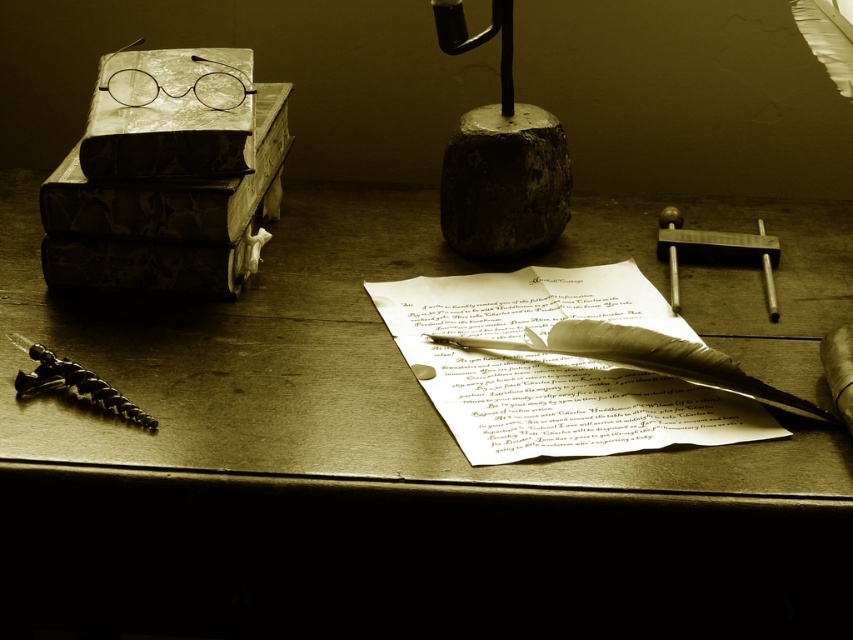
You are an archivist organizing items in this historical workspace. You need to place the white parchment paper at center and the metallic spiral tool at lower left into storage boxes. The box for taller items is labeled with a red sticker. Which object should go into the red sticker box?

The white parchment paper at center should go into the red sticker box because it is much taller than the metallic spiral tool at lower left.

You are an archaeologist examining the dark gray stone at center and the metallic polished hammer at right. Which object is wider?

The dark gray stone at center is wider than the metallic polished hammer at right.